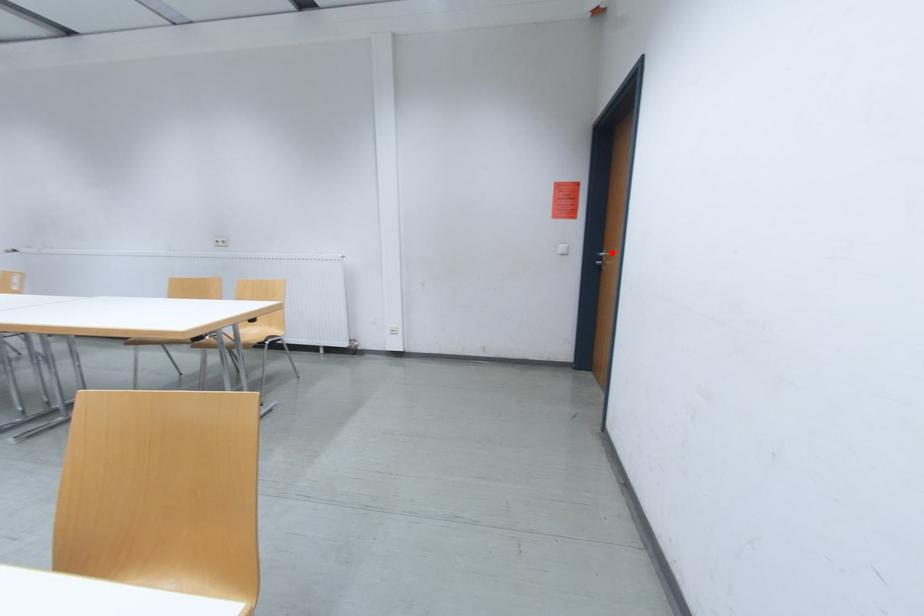
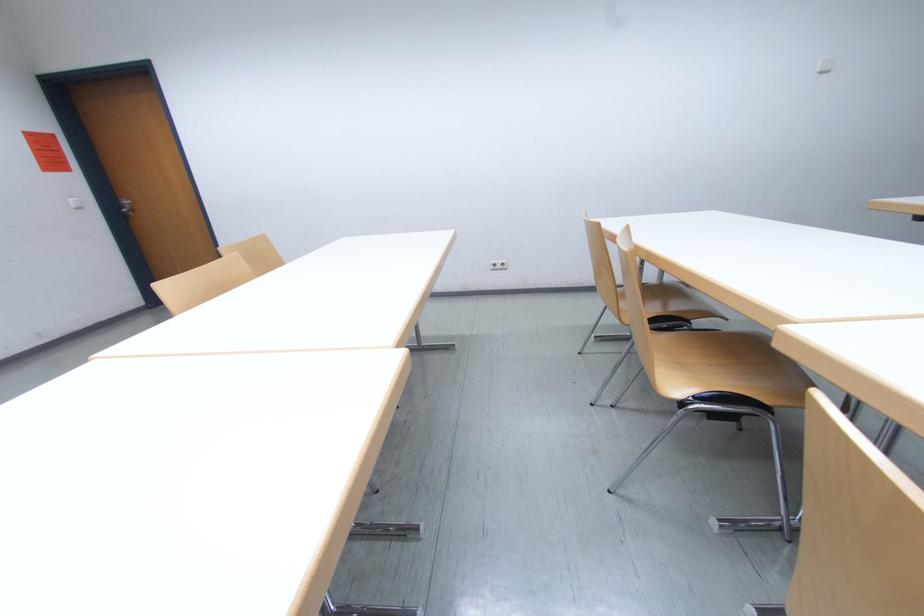
Question: I am providing you with two images of the same scene from different viewpoints. In image1, a red point is highlighted. Considering the same 3D point in image2, which of the following is correct?

Choices:
 (A) It is closer
 (B) It is farther

Answer: (B)